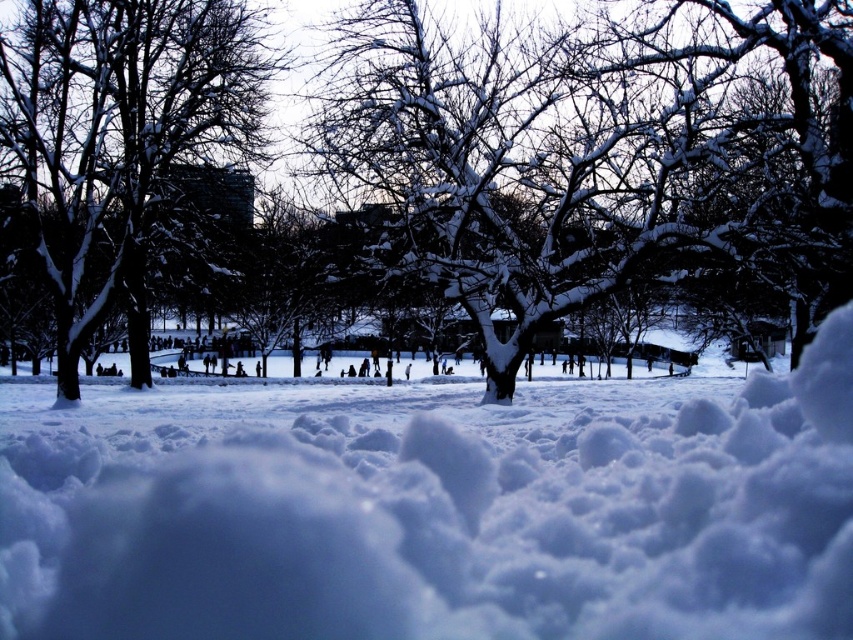
You are standing in the winter scene and want to walk from your current position to the point marked as point (466, 42). There is an obstacle at point (722, 573). Will you encounter the obstacle before reaching your destination?

Yes, you will encounter the obstacle at point (722, 573) before reaching point (466, 42) because point (722, 573) is in front of point (466, 42).